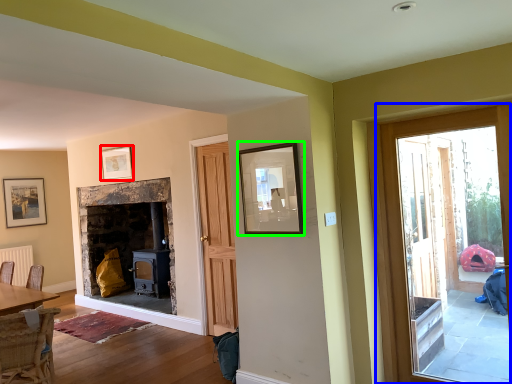
Question: Which is nearer to the picture frame (highlighted by a red box)? door (highlighted by a blue box) or picture frame (highlighted by a green box).

Choices:
 (A) door
 (B) picture frame

Answer: (B)